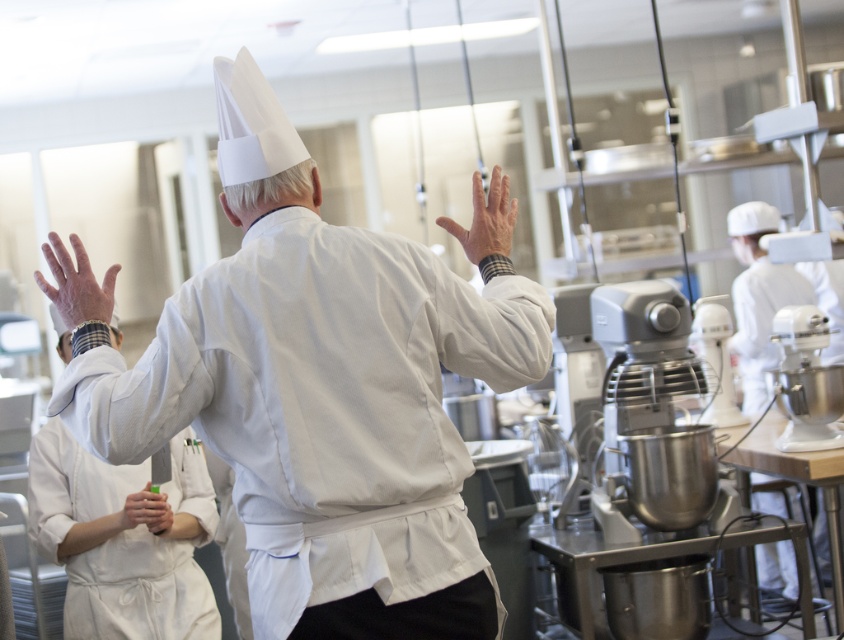
Question: Is the position of white matte chef's coat at left more distant than that of white matte chef hat at upper right?

Choices:
 (A) yes
 (B) no

Answer: (B)

Question: Is white matte chef's coat at left bigger than smooth white hand at center?

Choices:
 (A) no
 (B) yes

Answer: (B)

Question: Which of the following is the farthest from the observer?

Choices:
 (A) (150, 508)
 (B) (722, 364)
 (C) (52, 236)
 (D) (840, 396)

Answer: (B)

Question: Observing the image, what is the correct spatial positioning of white paper exhaust hood at upper center in reference to white metallic mixer at right?

Choices:
 (A) below
 (B) above

Answer: (B)

Question: Among these objects, which one is farthest from the camera?

Choices:
 (A) white metallic mixer at right
 (B) white paper exhaust hood at upper center

Answer: (A)

Question: Which point is closer to the camera taking this photo?

Choices:
 (A) (223, 168)
 (B) (291, 336)
 (C) (790, 404)

Answer: (B)